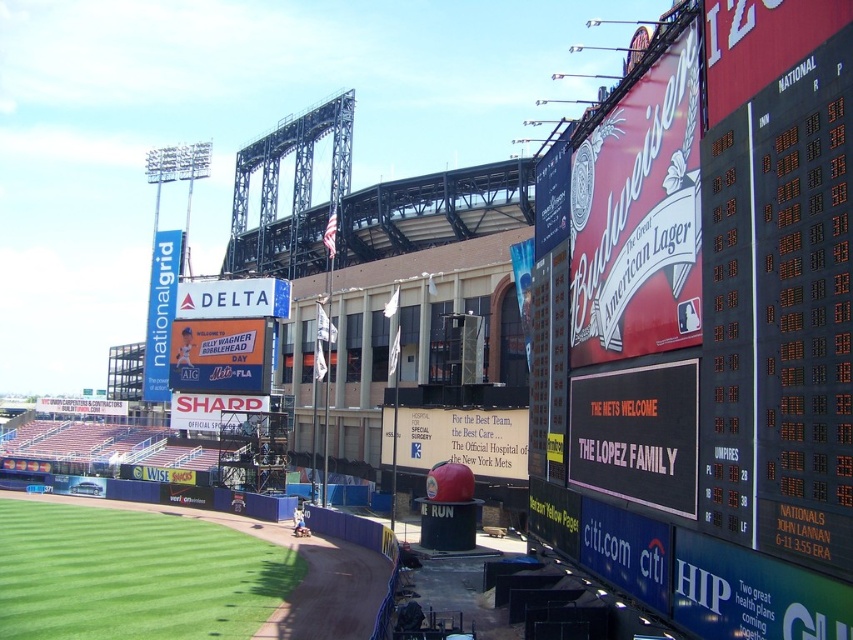
Question: Which object is closer to the camera taking this photo?

Choices:
 (A) green artificial turf at lower left
 (B) black plastic scoreboard at upper right

Answer: (B)

Question: Considering the relative positions of black plastic scoreboard at upper right and green artificial turf at lower left in the image provided, where is black plastic scoreboard at upper right located with respect to green artificial turf at lower left?

Choices:
 (A) left
 (B) right

Answer: (B)

Question: Which of the following is the farthest from the observer?

Choices:
 (A) (685, 93)
 (B) (10, 534)

Answer: (B)

Question: Does black plastic scoreboard at upper right have a larger size compared to green artificial turf at lower left?

Choices:
 (A) no
 (B) yes

Answer: (B)

Question: Which point is closer to the camera taking this photo?

Choices:
 (A) (74, 563)
 (B) (635, 349)

Answer: (B)

Question: Is black plastic scoreboard at upper right to the left of green artificial turf at lower left from the viewer's perspective?

Choices:
 (A) no
 (B) yes

Answer: (A)